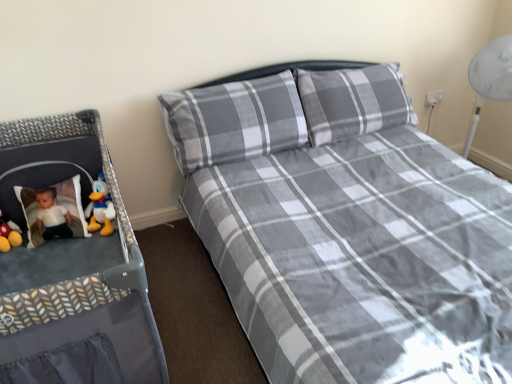
Question: Does gray plaid bed at center have a lesser height compared to gray plaid pillow at center?

Choices:
 (A) yes
 (B) no

Answer: (B)

Question: Considering the relative sizes of gray plaid bed at center and gray plaid pillow at center in the image provided, is gray plaid bed at center wider than gray plaid pillow at center?

Choices:
 (A) yes
 (B) no

Answer: (A)

Question: Is gray plaid bed at center placed right next to gray plaid pillow at center?

Choices:
 (A) yes
 (B) no

Answer: (B)

Question: Does gray plaid bed at center turn towards gray plaid pillow at center?

Choices:
 (A) yes
 (B) no

Answer: (B)

Question: Considering the relative sizes of gray plaid bed at center and gray plaid pillow at center in the image provided, is gray plaid bed at center bigger than gray plaid pillow at center?

Choices:
 (A) yes
 (B) no

Answer: (A)

Question: Does gray plaid bed at center have a lesser width compared to gray plaid pillow at center?

Choices:
 (A) no
 (B) yes

Answer: (A)

Question: Is matte yellow duck at left positioned in front of gray plaid pillow at center?

Choices:
 (A) no
 (B) yes

Answer: (A)

Question: Does matte yellow duck at left appear on the left side of gray plaid pillow at center?

Choices:
 (A) no
 (B) yes

Answer: (B)

Question: Is matte yellow duck at left with gray plaid pillow at center?

Choices:
 (A) no
 (B) yes

Answer: (A)

Question: From a real-world perspective, is matte yellow duck at left positioned under gray plaid pillow at center based on gravity?

Choices:
 (A) yes
 (B) no

Answer: (A)

Question: Does matte yellow duck at left have a smaller size compared to gray plaid pillow at center?

Choices:
 (A) no
 (B) yes

Answer: (B)

Question: Does matte yellow duck at left appear on the right side of gray plaid pillow at center?

Choices:
 (A) yes
 (B) no

Answer: (B)

Question: Is gray plaid pillow at center completely or partially outside of gray plaid bed at center?

Choices:
 (A) yes
 (B) no

Answer: (B)